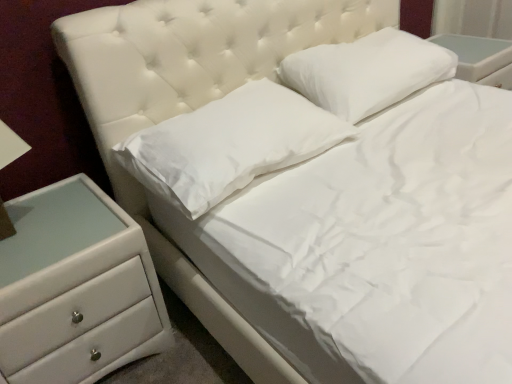
Question: Considering the relative sizes of white soft pillow at upper center, which is counted as the 1th pillow, starting from the right, and white soft pillow at center, which is the 2th pillow in right-to-left order, in the image provided, is white soft pillow at upper center, which is counted as the 1th pillow, starting from the right, wider than white soft pillow at center, which is the 2th pillow in right-to-left order,?

Choices:
 (A) yes
 (B) no

Answer: (B)

Question: From a real-world perspective, is white soft pillow at upper center, which is counted as the 1th pillow, starting from the right, on top of white soft pillow at center, which is the 2th pillow in right-to-left order?

Choices:
 (A) yes
 (B) no

Answer: (A)

Question: Is white soft pillow at upper center, which is counted as the 1th pillow, starting from the right, to the right of white soft pillow at center, which ranks as the first pillow in left-to-right order, from the viewer's perspective?

Choices:
 (A) no
 (B) yes

Answer: (B)

Question: Are white soft pillow at upper center, which appears as the 2th pillow when viewed from the left, and white soft pillow at center, which is the 2th pillow in right-to-left order, located far from each other?

Choices:
 (A) no
 (B) yes

Answer: (A)

Question: From a real-world perspective, is white soft pillow at upper center, which is counted as the 1th pillow, starting from the right, below white soft pillow at center, which is the 2th pillow in right-to-left order?

Choices:
 (A) no
 (B) yes

Answer: (A)

Question: Considering the positions of white soft pillow at center, which is the 2th pillow in right-to-left order, and white glossy chest of drawers at lower left in the image, is white soft pillow at center, which is the 2th pillow in right-to-left order, wider or thinner than white glossy chest of drawers at lower left?

Choices:
 (A) wide
 (B) thin

Answer: (B)

Question: Would you say white soft pillow at center, which ranks as the first pillow in left-to-right order, is to the left or to the right of white glossy chest of drawers at lower left in the picture?

Choices:
 (A) right
 (B) left

Answer: (A)

Question: Which is correct: white soft pillow at center, which ranks as the first pillow in left-to-right order, is inside white glossy chest of drawers at lower left, or outside of it?

Choices:
 (A) outside
 (B) inside

Answer: (A)

Question: From a real-world perspective, is white soft pillow at center, which is the 2th pillow in right-to-left order, positioned above or below white glossy chest of drawers at lower left?

Choices:
 (A) below
 (B) above

Answer: (B)

Question: From the image's perspective, is white soft pillow at upper center, which is counted as the 1th pillow, starting from the right, located above or below white soft pillow at center, which ranks as the first pillow in left-to-right order?

Choices:
 (A) below
 (B) above

Answer: (B)

Question: From a real-world perspective, relative to white soft pillow at center, which ranks as the first pillow in left-to-right order, is white soft pillow at upper center, which is counted as the 1th pillow, starting from the right, vertically above or below?

Choices:
 (A) above
 (B) below

Answer: (A)

Question: Considering the positions of white soft pillow at upper center, which appears as the 2th pillow when viewed from the left, and white soft pillow at center, which ranks as the first pillow in left-to-right order, in the image, is white soft pillow at upper center, which appears as the 2th pillow when viewed from the left, wider or thinner than white soft pillow at center, which ranks as the first pillow in left-to-right order,?

Choices:
 (A) thin
 (B) wide

Answer: (A)

Question: In the image, is white soft pillow at upper center, which is counted as the 1th pillow, starting from the right, on the left side or the right side of white soft pillow at center, which is the 2th pillow in right-to-left order?

Choices:
 (A) left
 (B) right

Answer: (B)

Question: Considering the positions of white soft pillow at upper center, which is counted as the 1th pillow, starting from the right, and white glossy chest of drawers at lower left in the image, is white soft pillow at upper center, which is counted as the 1th pillow, starting from the right, taller or shorter than white glossy chest of drawers at lower left?

Choices:
 (A) short
 (B) tall

Answer: (A)

Question: Relative to white glossy chest of drawers at lower left, is white soft pillow at upper center, which is counted as the 1th pillow, starting from the right, in front or behind?

Choices:
 (A) front
 (B) behind

Answer: (B)